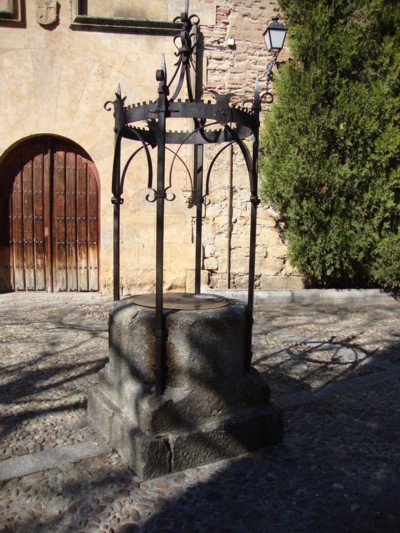
Where is `door`? This screenshot has width=400, height=533. door is located at coordinates (57, 220).